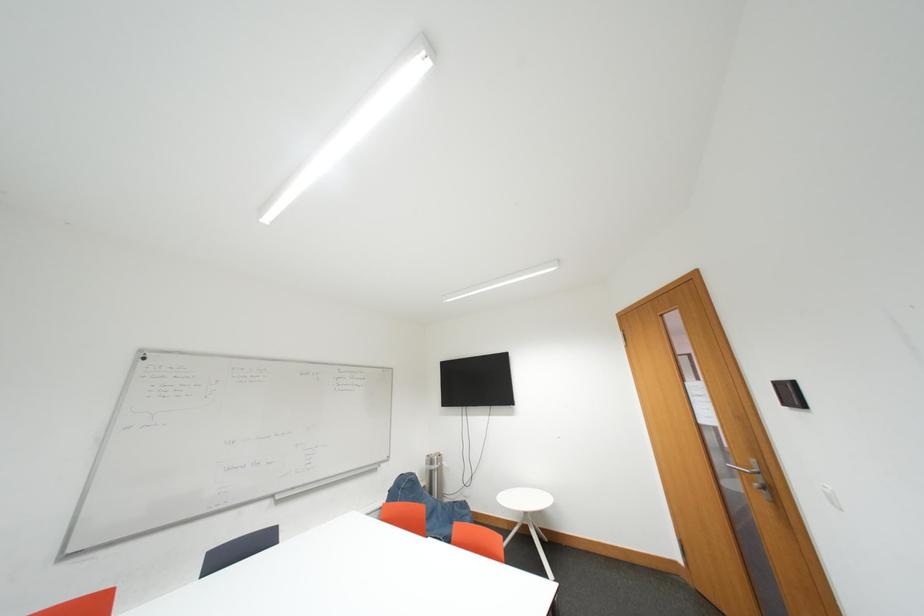
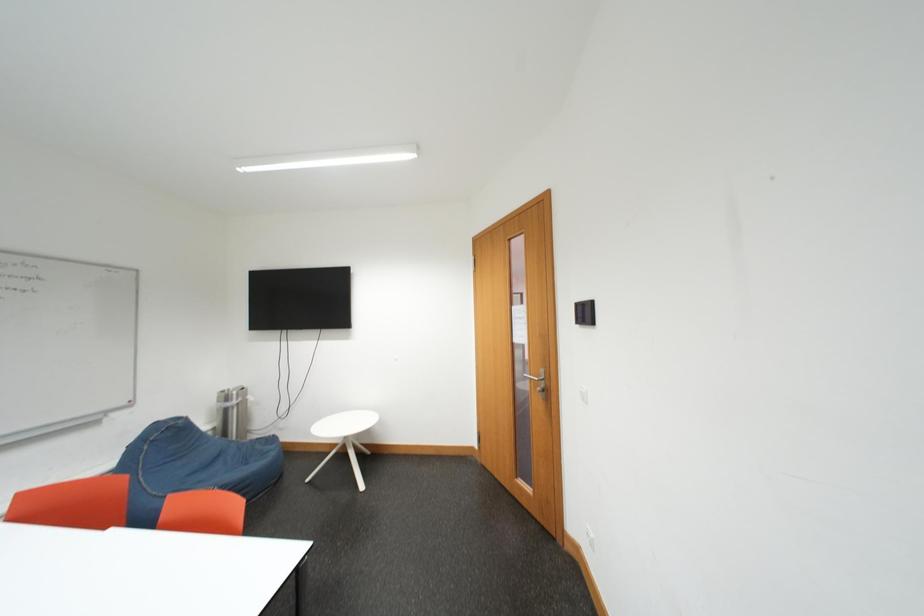
Question: How did the camera likely rotate?

Choices:
 (A) Left
 (B) Right
 (C) Up
 (D) Down

Answer: (B)